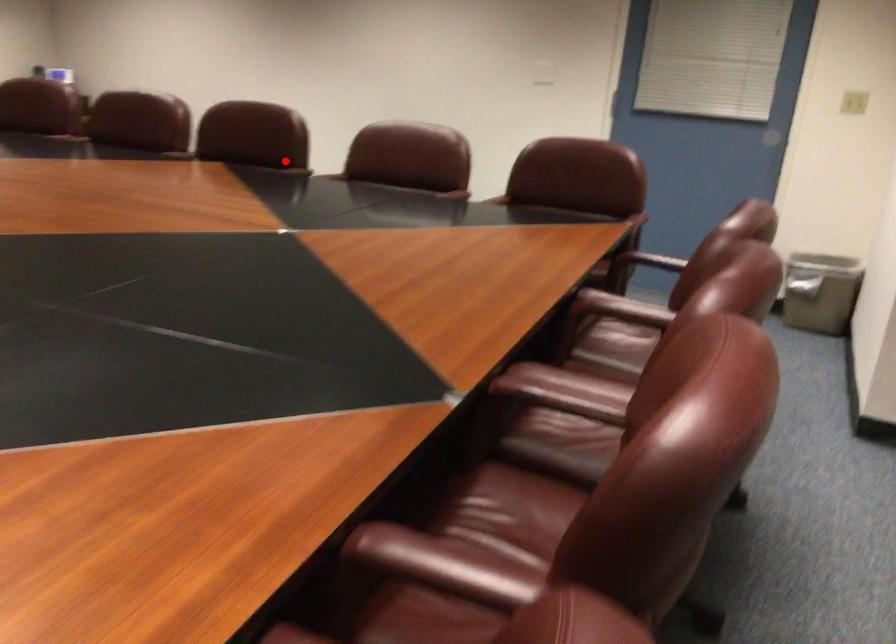
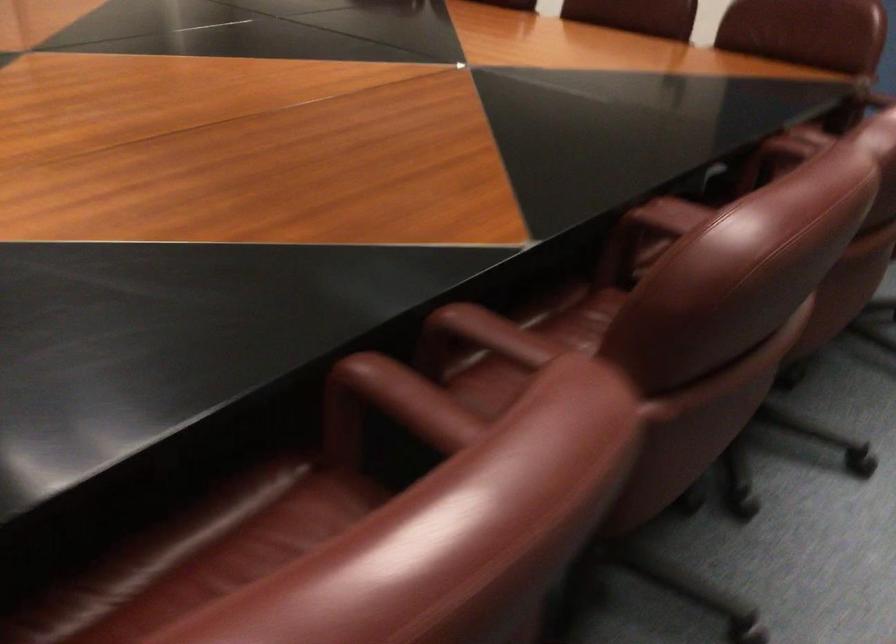
Question: I am providing you with two images of the same scene from different viewpoints. A red point is marked on the first image. Is the red point's position out of view in image 2?

Choices:
 (A) Yes
 (B) No

Answer: (B)